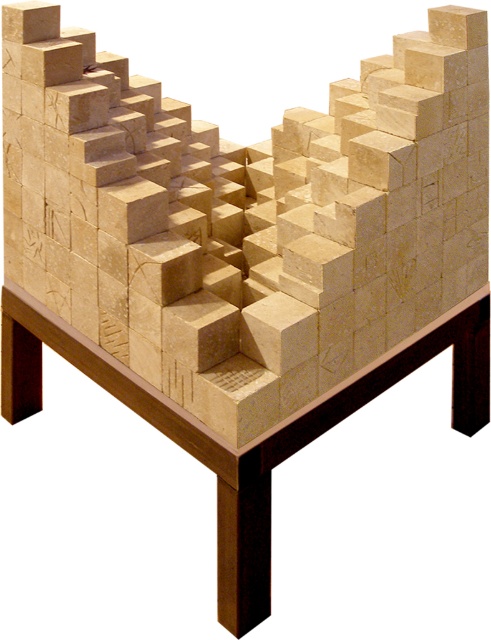
You are an art curator examining the sculpture and want to determine the spatial relationship between two points on the sculpture. Specifically, you are looking at point (459, 288) and point (470, 317). Which point is closer to the viewer?

Point (459, 288) is in front of point (470, 317), so it is closer to the viewer.

You are standing in front of the sculpture and want to place a small decorative item on the natural wood cube at center. If your hand can reach up to 1.0 meters, will you be able to place the item without moving closer?

The natural wood cube at center is 1.06 meters away from the viewer. Since your hand can only reach up to 1.0 meters, you will not be able to place the item without moving closer.